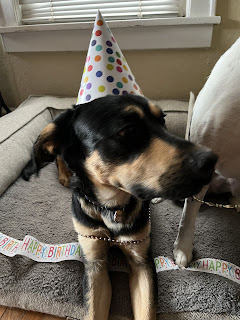
This screenshot has width=240, height=320. I want to click on wood floor, so click(x=18, y=314).